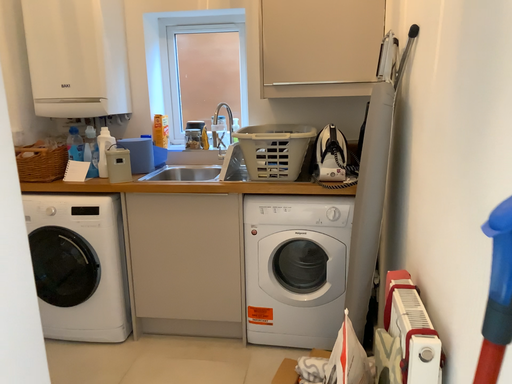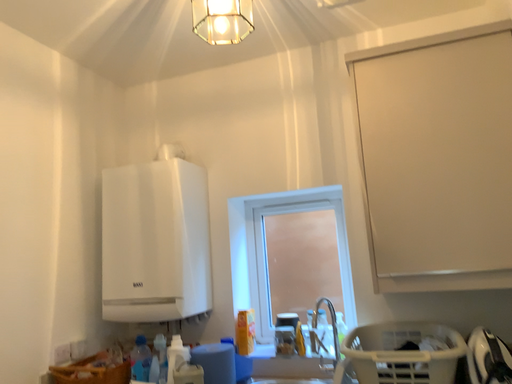
Question: Which way did the camera rotate in the video?

Choices:
 (A) rotated right
 (B) rotated left

Answer: (B)